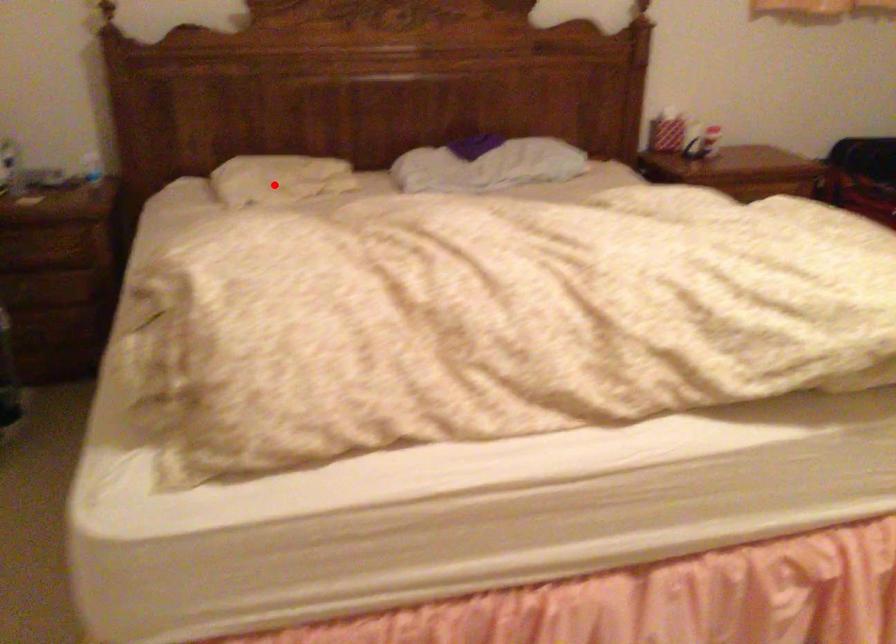
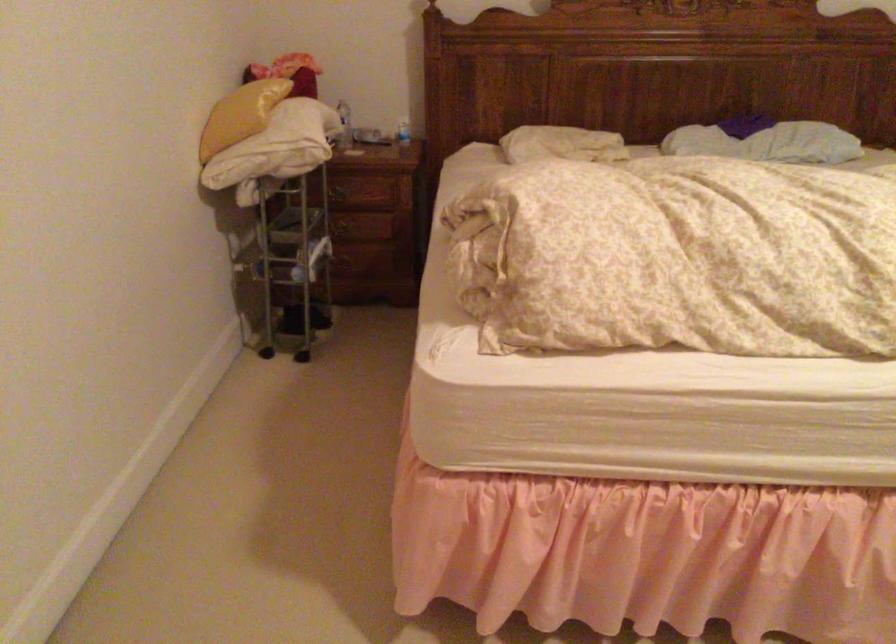
Find the pixel in the second image that matches the highlighted location in the first image.

(561, 144)